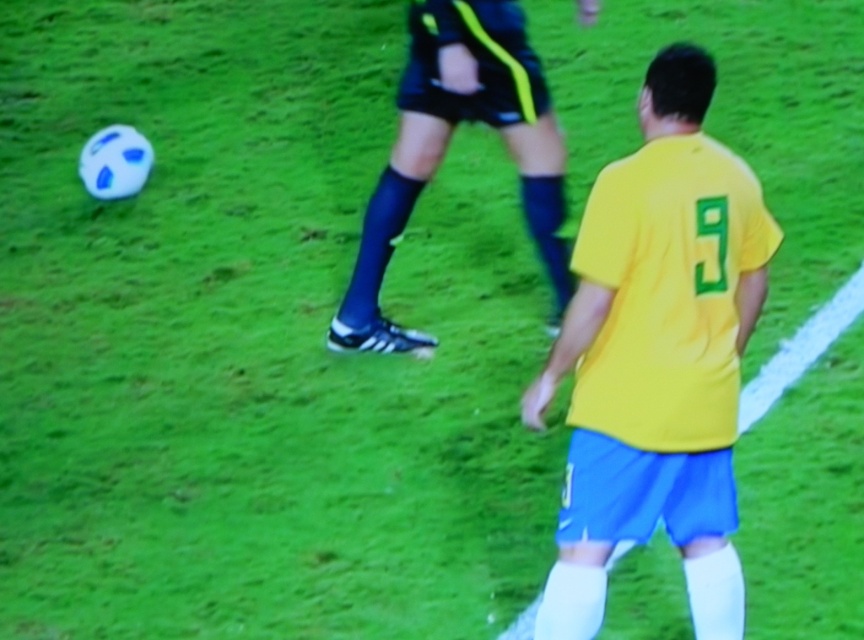
Question: Is yellow matte jersey at center above black synthetic shorts at center?

Choices:
 (A) yes
 (B) no

Answer: (B)

Question: Among these points, which one is farthest from the camera?

Choices:
 (A) (544, 387)
 (B) (558, 218)

Answer: (B)

Question: Can you confirm if yellow matte jersey at center is wider than black synthetic shorts at center?

Choices:
 (A) no
 (B) yes

Answer: (A)

Question: In this image, where is yellow matte jersey at center located relative to black synthetic shorts at center?

Choices:
 (A) below
 (B) above

Answer: (A)

Question: Which point appears farthest from the camera in this image?

Choices:
 (A) (562, 195)
 (B) (718, 536)

Answer: (A)